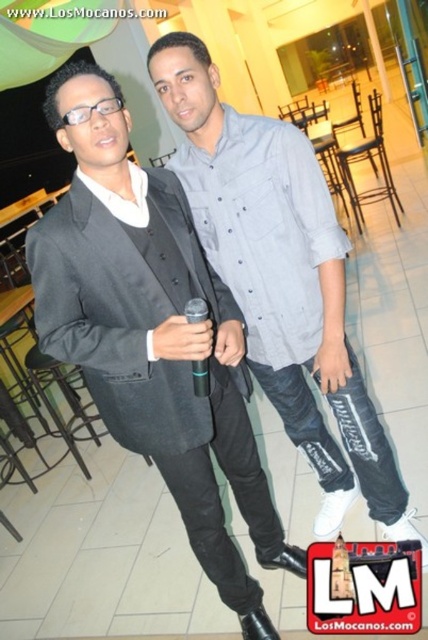
Is matte black suit at left taller than gray cotton shirt at center?

Yes, matte black suit at left is taller than gray cotton shirt at center.

Is matte black suit at left to the right of gray cotton shirt at center from the viewer's perspective?

In fact, matte black suit at left is to the left of gray cotton shirt at center.

Which is in front, point (214, 273) or point (160, 51)?

Point (160, 51) is in front.

Locate an element on the screen. matte black suit at left is located at coordinates (151, 333).